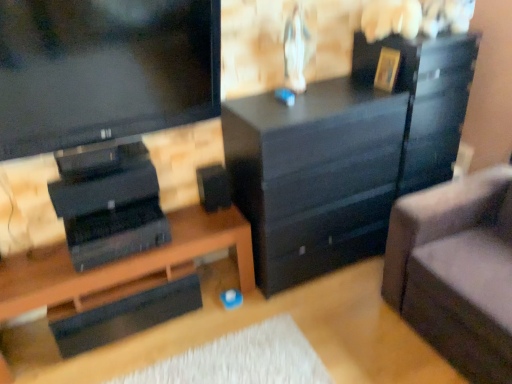
I want to click on empty space that is in between black matte chest of drawers at center and black matte desk at lower left, so click(184, 334).